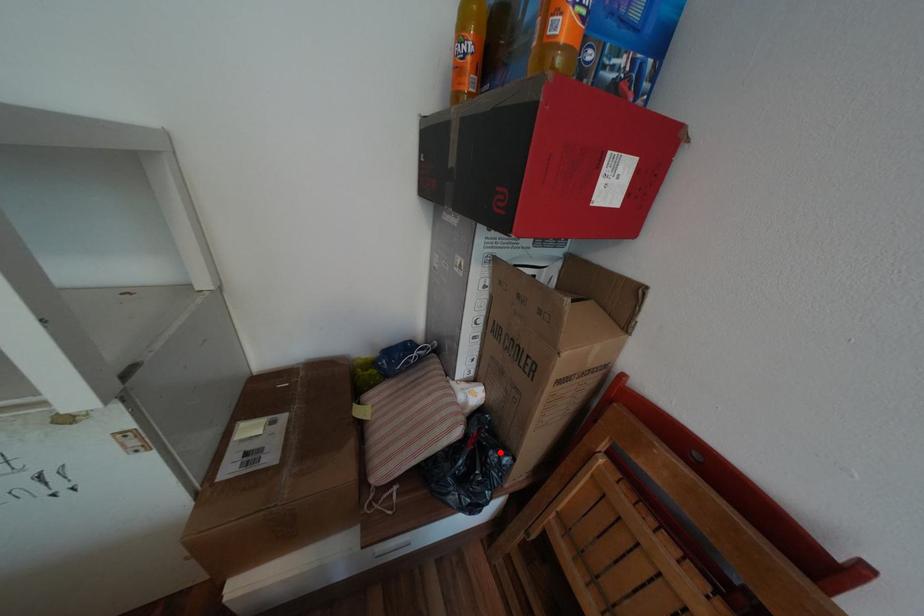
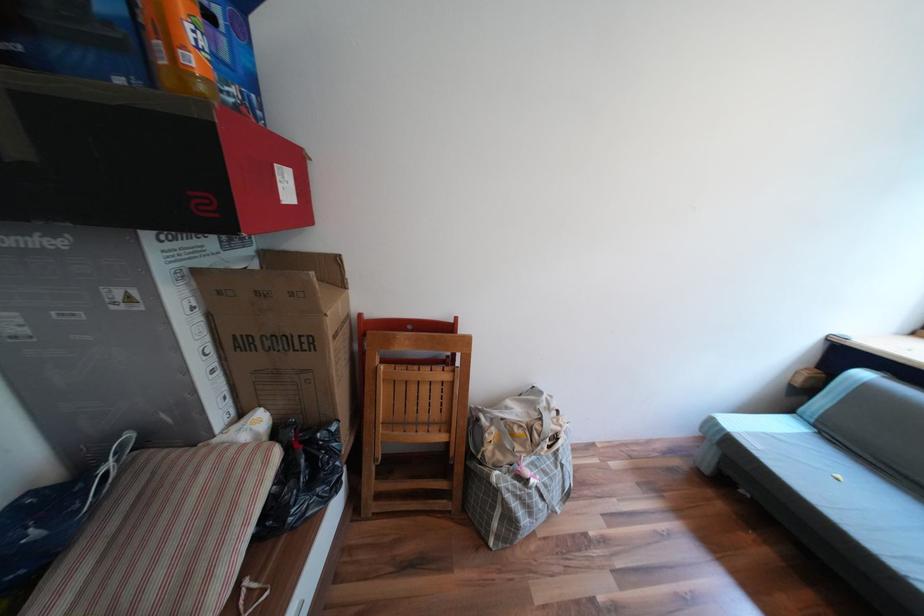
Question: A red point is marked in image1. In image2, is the corresponding 3D point closer to the camera or farther? Reply with the corresponding letter.

Choices:
 (A) The corresponding 3D point is closer.
 (B) The corresponding 3D point is farther.

Answer: (A)